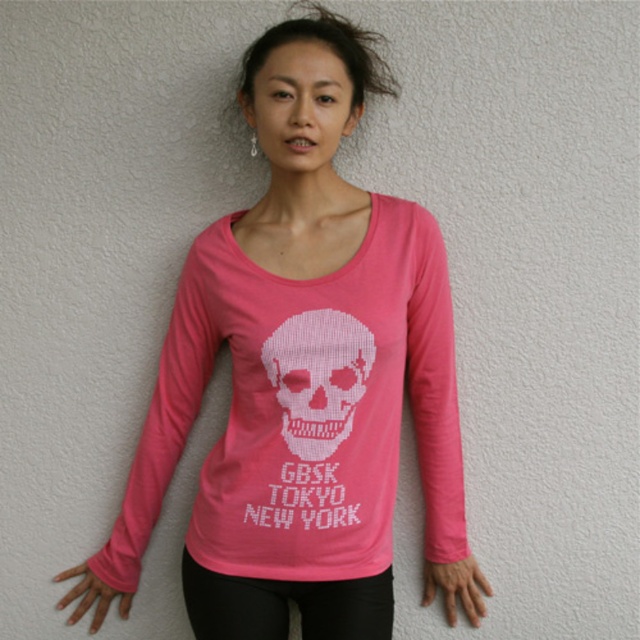
Question: Which of the following is the farthest from the observer?

Choices:
 (A) (266, 355)
 (B) (269, 49)
 (C) (460, 602)

Answer: (C)

Question: Which point is farther to the camera?

Choices:
 (A) pink matte hand at lower left
 (B) matte pink hand at lower center
 (C) black matte leggings at lower center
 (D) matte pink t-shirt at center

Answer: (A)

Question: Is black matte leggings at lower center below matte pink hand at lower center?

Choices:
 (A) yes
 (B) no

Answer: (B)

Question: Considering the relative positions of matte pink t-shirt at center and white knitted skull at center in the image provided, where is matte pink t-shirt at center located with respect to white knitted skull at center?

Choices:
 (A) above
 (B) below

Answer: (A)

Question: Does matte pink hand at lower center have a larger size compared to pink matte hand at lower left?

Choices:
 (A) no
 (B) yes

Answer: (B)

Question: Which of the following is the farthest from the observer?

Choices:
 (A) pink matte hand at lower left
 (B) matte pink hand at lower center
 (C) white knitted skull at center
 (D) black matte leggings at lower center

Answer: (A)